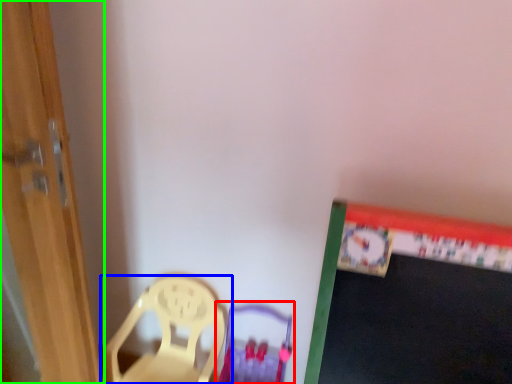
Question: Considering the real-world distances, which object is farthest from armchair (highlighted by a red box)? chair (highlighted by a blue box) or door (highlighted by a green box)?

Choices:
 (A) chair
 (B) door

Answer: (B)